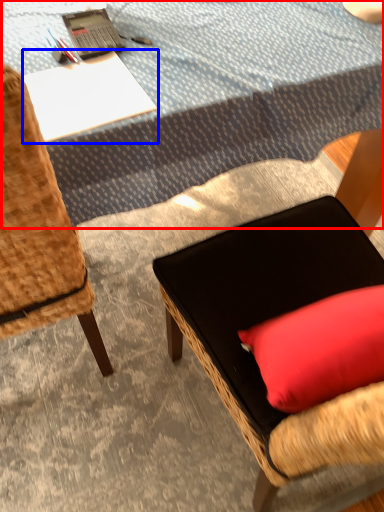
Question: Which point is further to the camera, tablecloth (highlighted by a red box) or desk (highlighted by a blue box)?

Choices:
 (A) tablecloth
 (B) desk

Answer: (A)